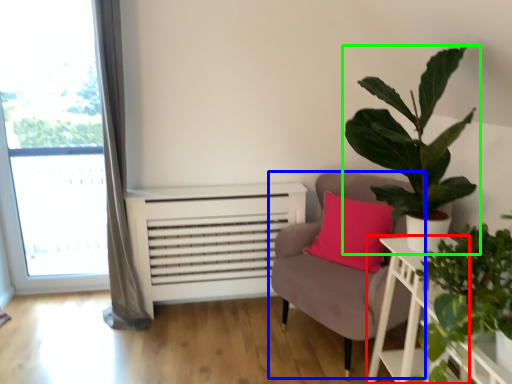
Question: Estimate the real-world distances between objects in this image. Which object is farther from table (highlighted by a red box), chair (highlighted by a blue box) or houseplant (highlighted by a green box)?

Choices:
 (A) chair
 (B) houseplant

Answer: (A)